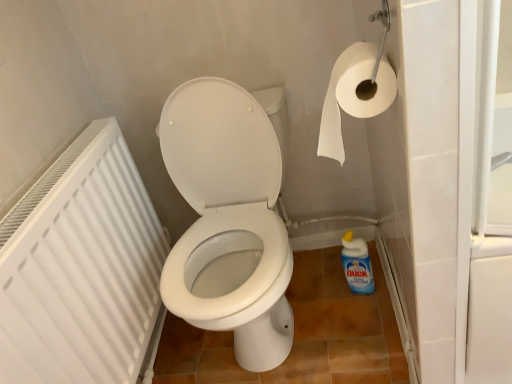
Question: From a real-world perspective, is blue glossy bottle at lower right positioned above or below white plastic radiator at left?

Choices:
 (A) above
 (B) below

Answer: (B)

Question: Is point [350, 284] positioned closer to the camera than point [84, 294]?

Choices:
 (A) closer
 (B) farther

Answer: (B)

Question: Estimate the real-world distances between objects in this image. Which object is closer to the white paper at upper right?

Choices:
 (A) blue glossy bottle at lower right
 (B) white plastic radiator at left

Answer: (B)

Question: Which of these objects is positioned farthest from the white paper at upper right?

Choices:
 (A) blue glossy bottle at lower right
 (B) white plastic radiator at left

Answer: (A)